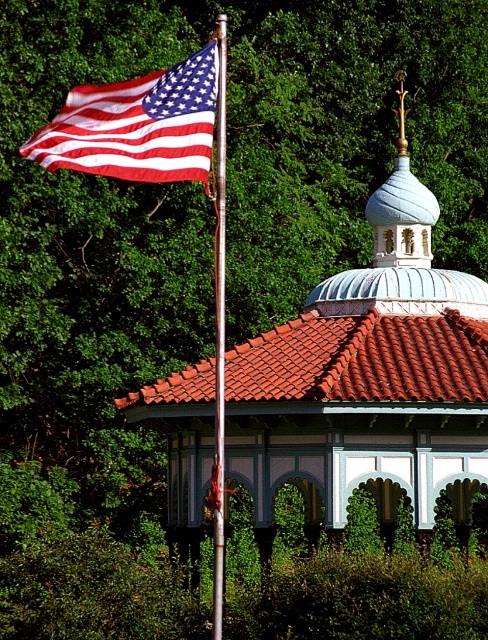
You are an architect designing a miniature model of this scene. The gazebo and dome must be scaled down proportionally. If the white painted wood gazebo at center is to be 10 inches wide in the model, what should be the maximum width of the white textured dome at upper center to maintain the correct proportions?

Since the white painted wood gazebo at center is larger in width than the white textured dome at upper center in the original scene, the model must reflect this. If the gazebo is scaled to 10 inches, the dome should be narrower than 10 inches to maintain proportion.

You are standing in front of the gazebo and want to take a photo of both the white painted wood gazebo at center and the red clay tiles at center. Which object should you focus on first to ensure both are in focus?

You should focus on the white painted wood gazebo at center first because it is closer to you than the red clay tiles at center, ensuring both are in focus when using depth of field.